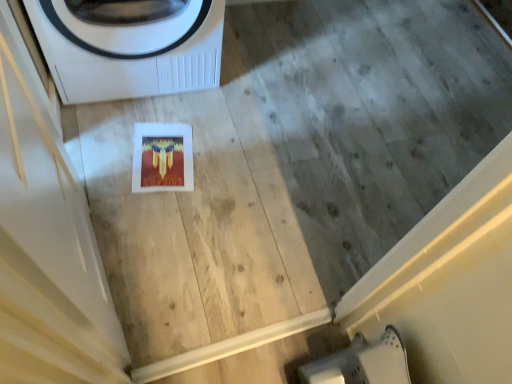
What are the coordinates of `vacant space in front of white plastic washing machine at upper left` in the screenshot? It's located at (147, 155).